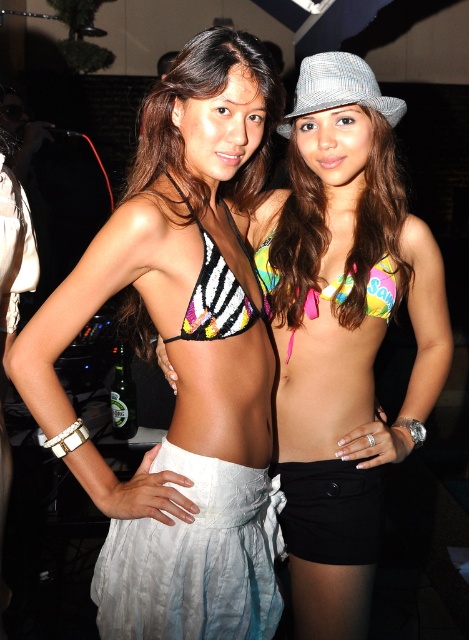
Is zebra-patterned sequined bikini top at center positioned in front of neon tie-dye bikini top at center?

Yes, it is.

Who is higher up, zebra-patterned sequined bikini top at center or neon tie-dye bikini top at center?

Positioned higher is zebra-patterned sequined bikini top at center.

Which is in front, point (193, 333) or point (318, 294)?

Positioned in front is point (193, 333).

This screenshot has width=469, height=640. I want to click on zebra-patterned sequined bikini top at center, so [219, 289].

Is white fabric skirt at lower left behind gray herringbone fedora at upper center?

No.

Is white fabric skirt at lower left above gray herringbone fedora at upper center?

Incorrect, white fabric skirt at lower left is not positioned above gray herringbone fedora at upper center.

Is point (264, 600) positioned after point (355, 65)?

No, (264, 600) is in front of (355, 65).

Image resolution: width=469 pixels, height=640 pixels. What are the coordinates of `white fabric skirt at lower left` in the screenshot? It's located at click(196, 560).

Between black matte shorts at lower center and zebra-patterned sequined bikini top at center, which one is positioned higher?

zebra-patterned sequined bikini top at center

Where is `black matte shorts at lower center`? This screenshot has width=469, height=640. black matte shorts at lower center is located at coordinates (332, 509).